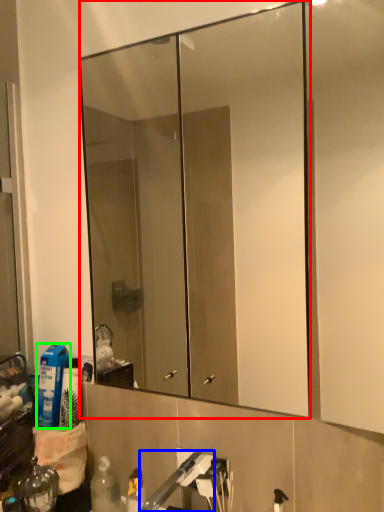
Question: Based on their relative distances, which object is nearer to mirror (highlighted by a red box)? Choose from faucet (highlighted by a blue box) and cleaning product (highlighted by a green box).

Choices:
 (A) faucet
 (B) cleaning product

Answer: (B)